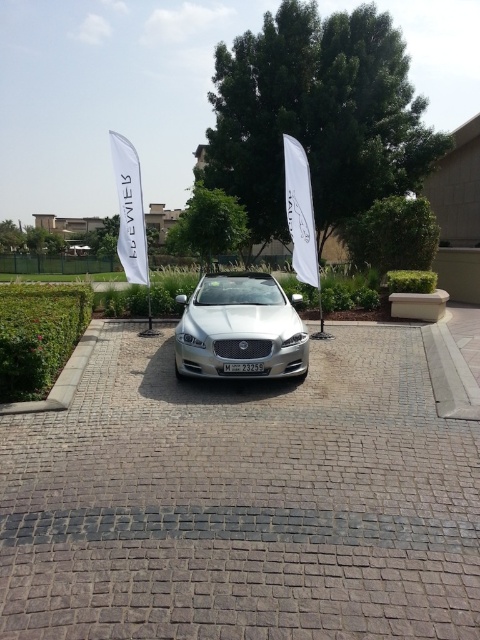
You are planning to park a large truck that is 2 meters wide in the gray cobblestone driveway at center. Can the truck fit into the driveway based on its width compared to the white fabric canopy at left?

The gray cobblestone driveway at center has a width less than the white fabric canopy at left. Therefore, the truck that is 2 meters wide may not fit into the driveway since its width is narrower than the canopy.

You are standing at the point marked by the coordinates [242,500] in the image. Based on the scene description, what object are you standing on?

The point at coordinates [242,500] corresponds to the gray cobblestone driveway at center, so you are standing on the gray cobblestone driveway at center.

You are standing at point (189, 369) and want to walk to point (478, 577). Given the scene described, will you have to walk past the silver Jaguar car parked centrally?

Yes, you will have to walk past the silver Jaguar car parked centrally because point (478, 577) is in front of point (189, 369), meaning the path to the destination requires moving towards the direction where the car is located.